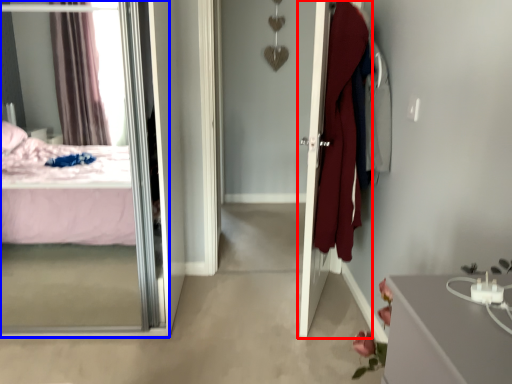
Question: Which point is closer to the camera, door (highlighted by a red box) or mirror (highlighted by a blue box)?

Choices:
 (A) door
 (B) mirror

Answer: (B)